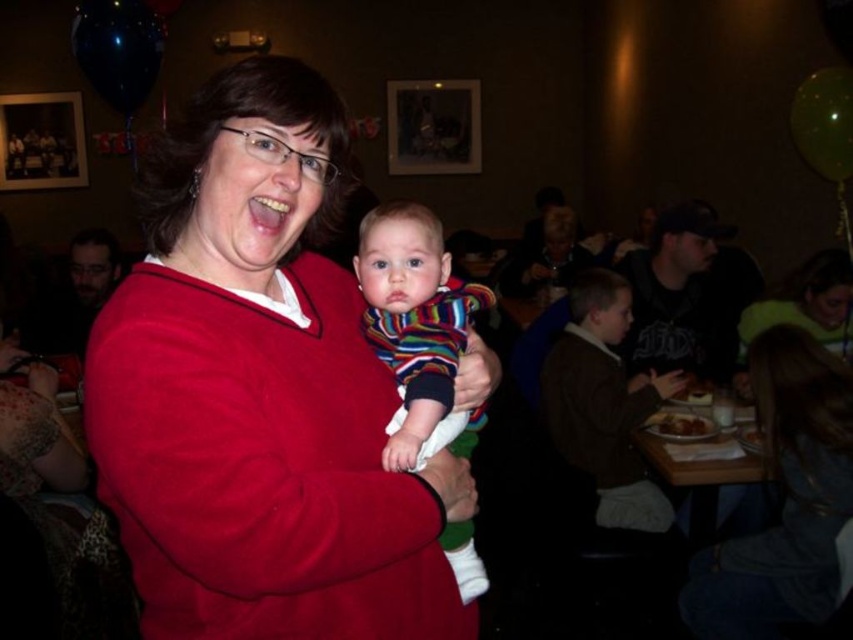
You are a photographer at the event and want to ensure the matte red sweater at center and the striped fabric baby at center are both in focus. Since the sweater is above the baby, which object should you focus on first to capture both clearly?

Since the matte red sweater at center is located above the striped fabric baby at center, you should focus on the matte red sweater at center first as it is closer to the camera, ensuring both are in focus.

You are a photographer trying to capture a clear photo of the striped fabric baby at center without the matte red sweater at center blocking it. What should you do?

The matte red sweater at center is in front of the striped fabric baby at center, so you should move the matte red sweater at center out of the way or adjust your angle to avoid the obstruction.

What are the coordinates of the matte red sweater at center?

The coordinates of the matte red sweater at center are at point (260, 392).